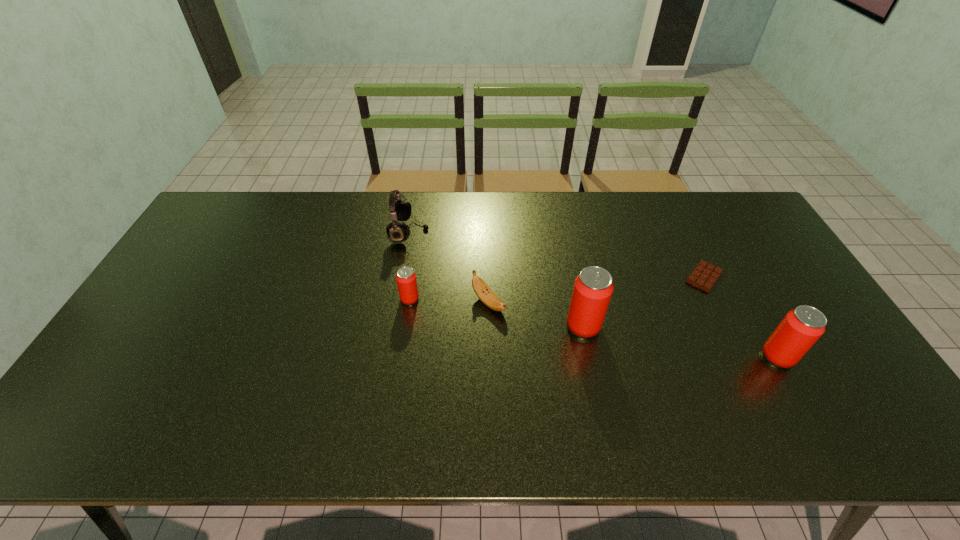
This screenshot has width=960, height=540. Identify the location of vacant space located on the back of the fourth tallest object. (418, 244).

This screenshot has height=540, width=960. What are the coordinates of `vacant area situated 0.340m on the left of the second farthest beer can` in the screenshot? It's located at [x=442, y=326].

At what (x,y) coordinates should I click in order to perform the action: click on free spot located on the back of the nearest object. Please return your answer as a coordinate pair (x, y). This screenshot has width=960, height=540. Looking at the image, I should click on (735, 281).

At what (x,y) coordinates should I click in order to perform the action: click on vacant space located 0.070m with the microphone on the side of the headset. Please return your answer as a coordinate pair (x, y). This screenshot has height=540, width=960. Looking at the image, I should click on (449, 232).

This screenshot has width=960, height=540. What are the coordinates of `free space located on the front of the fifth tallest object` in the screenshot? It's located at tap(491, 396).

Locate an element on the screen. Image resolution: width=960 pixels, height=540 pixels. vacant space located 0.150m on the front of the shortest object is located at coordinates (732, 334).

Where is `object that is at the far edge`? This screenshot has width=960, height=540. object that is at the far edge is located at coordinates (400, 210).

The height and width of the screenshot is (540, 960). What are the coordinates of `object that is at the right edge` in the screenshot? It's located at (799, 330).

In the image, there is a desktop. At what (x,y) coordinates should I click in order to perform the action: click on vacant space at the far edge. Please return your answer as a coordinate pair (x, y). Image resolution: width=960 pixels, height=540 pixels. Looking at the image, I should click on (644, 211).

This screenshot has width=960, height=540. In the image, there is a desktop. What are the coordinates of `vacant area at the near edge` in the screenshot? It's located at (369, 402).